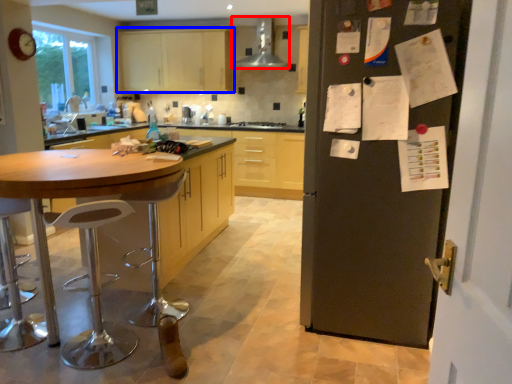
Question: Which object is further to the camera taking this photo, kitchen appliance (highlighted by a red box) or cabinetry (highlighted by a blue box)?

Choices:
 (A) kitchen appliance
 (B) cabinetry

Answer: (B)